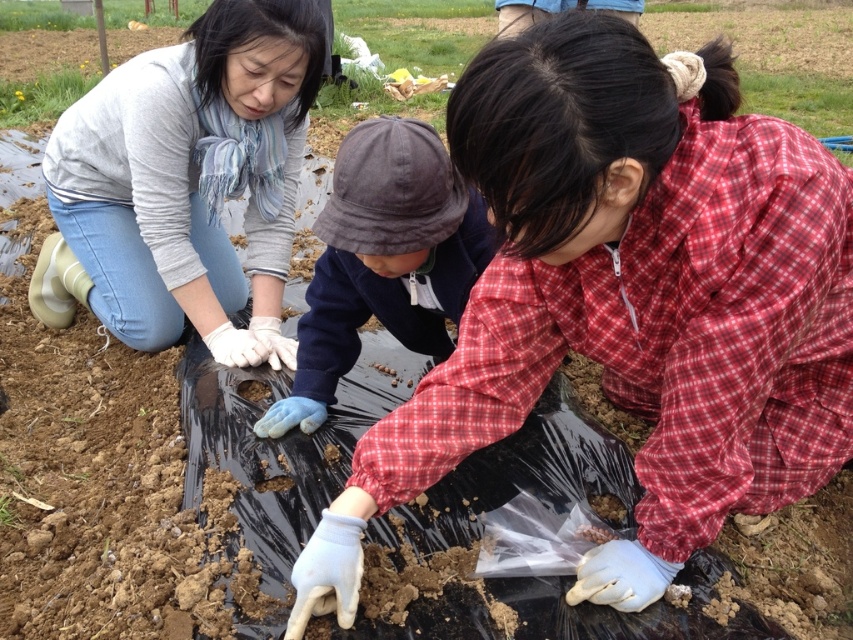
Question: Considering the real-world distances, which object is closest to the matte red shirt at center?

Choices:
 (A) green grass at upper left
 (B) blue cotton hat at center
 (C) matte gray sweater at upper left
 (D) black plastic bag at center

Answer: (B)

Question: Which point appears farthest from the camera in this image?

Choices:
 (A) (281, 413)
 (B) (744, 90)
 (C) (4, 99)
 (D) (547, 58)

Answer: (B)

Question: Can you confirm if blue cotton hat at center is positioned to the left of black plastic bag at center?

Choices:
 (A) no
 (B) yes

Answer: (B)

Question: Which of the following is the closest to the observer?

Choices:
 (A) matte gray sweater at upper left
 (B) black plastic bag at center

Answer: (A)

Question: From the image, what is the correct spatial relationship of blue cotton hat at center in relation to black plastic bag at center?

Choices:
 (A) above
 (B) below

Answer: (B)

Question: Does matte gray sweater at upper left have a greater width compared to black plastic bag at center?

Choices:
 (A) no
 (B) yes

Answer: (A)